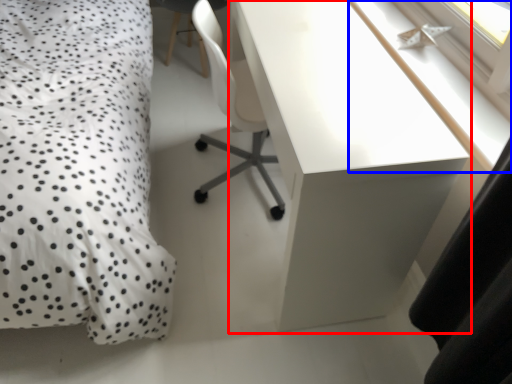
Question: Which of the following is the farthest to the observer, desk (highlighted by a red box) or window sill (highlighted by a blue box)?

Choices:
 (A) desk
 (B) window sill

Answer: (B)